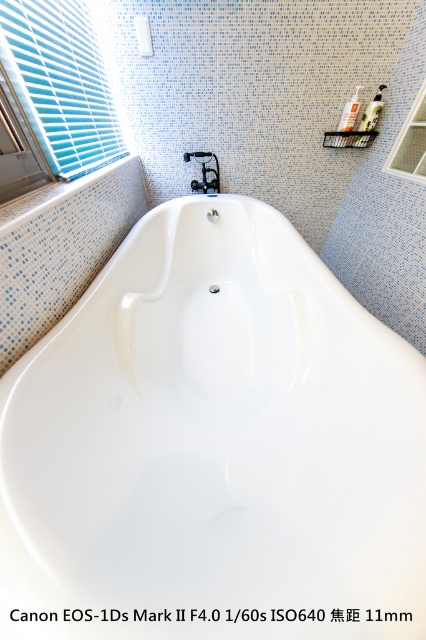
Does point (69, 58) lie in front of point (203, 152)?

Yes.

Can you confirm if blue plastic blinds at upper left is bigger than black plastic faucet at center?

Yes, blue plastic blinds at upper left is bigger than black plastic faucet at center.

Measure the distance between blue plastic blinds at upper left and camera.

A distance of 39.12 inches exists between blue plastic blinds at upper left and camera.

Locate an element on the screen. The height and width of the screenshot is (640, 426). blue plastic blinds at upper left is located at coordinates (60, 83).

Is white glossy bathtub at center to the left of black plastic faucet at center from the viewer's perspective?

No, white glossy bathtub at center is not to the left of black plastic faucet at center.

Between point (204, 314) and point (206, 186), which one is positioned behind?

The point (206, 186) is more distant.

Where is `white glossy bathtub at center`? This screenshot has height=640, width=426. white glossy bathtub at center is located at coordinates (215, 444).

Is blue plastic blinds at upper left bigger than clear glass window at upper right?

Yes, blue plastic blinds at upper left is bigger than clear glass window at upper right.

Is the position of blue plastic blinds at upper left less distant than that of clear glass window at upper right?

Yes.

At what (x,y) coordinates should I click in order to perform the action: click on blue plastic blinds at upper left. Please return your answer as a coordinate pair (x, y). Image resolution: width=426 pixels, height=640 pixels. Looking at the image, I should click on (60, 83).